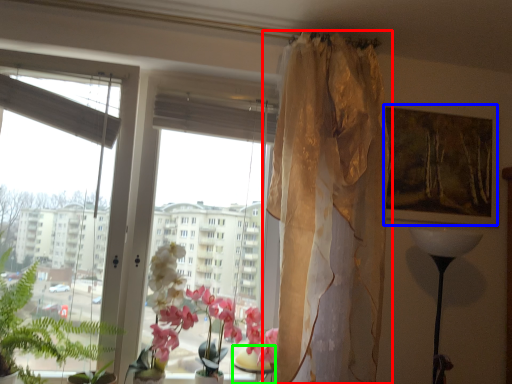
Question: Which object is positioned farthest from curtain (highlighted by a red box)? Select from picture frame (highlighted by a blue box) and table (highlighted by a green box).

Choices:
 (A) picture frame
 (B) table

Answer: (B)